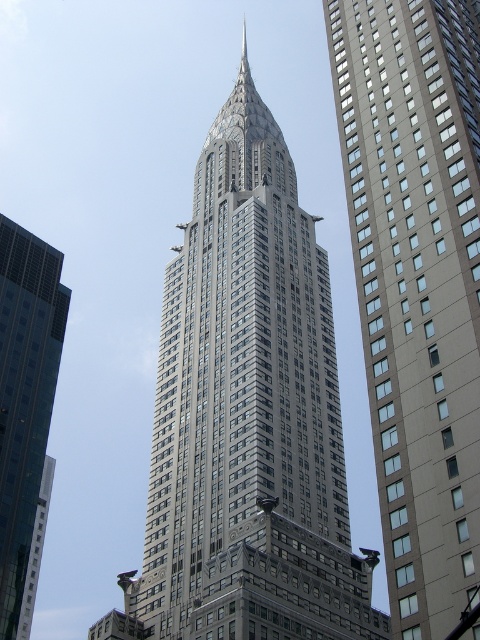
You are standing at the point marked as point (249,413) in the image. What do you see directly in front of you?

You see the gray metallic skyscraper at center directly in front of you at point (249,413).

You are a photographer planning to capture the Chrysler Building and the glassy reflective skyscraper at left in a single wide shot. Given that your camera can only capture a horizontal field of view up to 10 meters wide, and the gray glass skyscraper at center is 8 meters wide, will both skyscrapers fit in the frame if they are positioned side by side?

The gray glass skyscraper at center is wider than the glassy reflective skyscraper at left. Since the gray glass skyscraper at center alone is already 8 meters wide, adding the width of the glassy reflective skyscraper at left would exceed the camera field of view limit of 10 meters. Therefore, both skyscrapers cannot fit in the frame together.

You are standing in a park across the street from the gray glass skyscraper at center. The park has a walking path that is 35 meters long. If you start walking from the entrance of the park towards the skyscraper, will you reach the skyscraper before the path ends?

The gray glass skyscraper at center is 37.07 meters from the viewer. The walking path is only 35 meters long, so you will not reach the skyscraper before the path ends.